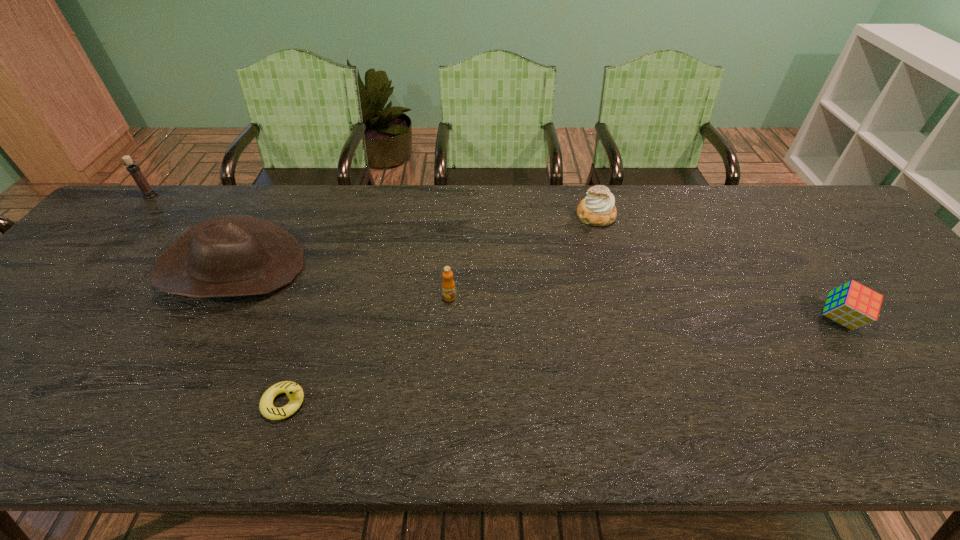
Where is `the leftmost object`? The height and width of the screenshot is (540, 960). the leftmost object is located at coordinates (134, 170).

Locate an element on the screen. Image resolution: width=960 pixels, height=540 pixels. the farthest object is located at coordinates tap(134, 170).

Identify the location of cowboy hat. (229, 255).

Identify the location of pastry. (597, 209).

Locate an element on the screen. This screenshot has height=540, width=960. the second object from right to left is located at coordinates (597, 209).

This screenshot has width=960, height=540. I want to click on the third object from right to left, so click(x=448, y=285).

Identify the location of cube. This screenshot has height=540, width=960. (853, 305).

This screenshot has height=540, width=960. Find the location of `the shortest object`. the shortest object is located at coordinates (294, 392).

At what (x,y) coordinates should I click in order to perform the action: click on the fourth object from right to left. Please return your answer as a coordinate pair (x, y). The width and height of the screenshot is (960, 540). Looking at the image, I should click on (294, 392).

Image resolution: width=960 pixels, height=540 pixels. In order to click on vacant space situated on the right of the candle holder in this screenshot , I will do `click(206, 195)`.